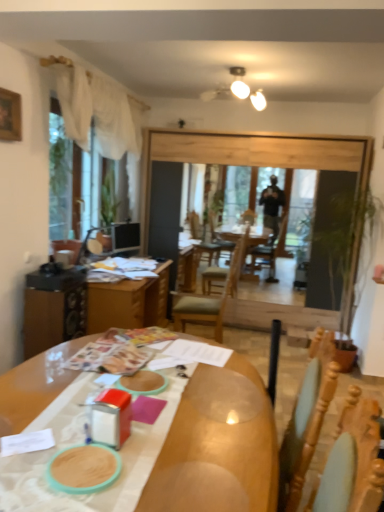
Question: Can you confirm if wooden chair at center is smaller than wooden table at center?

Choices:
 (A) yes
 (B) no

Answer: (A)

Question: Is the position of wooden chair at center more distant than that of wooden table at center?

Choices:
 (A) no
 (B) yes

Answer: (B)

Question: From a real-world perspective, is wooden chair at center positioned over wooden table at center based on gravity?

Choices:
 (A) no
 (B) yes

Answer: (B)

Question: Can you confirm if wooden chair at center is wider than wooden table at center?

Choices:
 (A) no
 (B) yes

Answer: (A)

Question: Is wooden chair at center positioned far away from wooden table at center?

Choices:
 (A) no
 (B) yes

Answer: (A)

Question: Can you confirm if wooden chair at center is positioned to the left of wooden table at center?

Choices:
 (A) yes
 (B) no

Answer: (B)

Question: From the image's perspective, does wooden picture frame at upper left appear lower than matte black monitor at left?

Choices:
 (A) yes
 (B) no

Answer: (B)

Question: Can you confirm if wooden picture frame at upper left is shorter than matte black monitor at left?

Choices:
 (A) no
 (B) yes

Answer: (B)

Question: Can you confirm if wooden picture frame at upper left is thinner than matte black monitor at left?

Choices:
 (A) yes
 (B) no

Answer: (A)

Question: Are wooden picture frame at upper left and matte black monitor at left making contact?

Choices:
 (A) no
 (B) yes

Answer: (A)

Question: Does wooden picture frame at upper left appear on the left side of matte black monitor at left?

Choices:
 (A) no
 (B) yes

Answer: (B)

Question: Considering the relative sizes of wooden picture frame at upper left and matte black monitor at left in the image provided, is wooden picture frame at upper left wider than matte black monitor at left?

Choices:
 (A) yes
 (B) no

Answer: (B)

Question: Does matte black monitor at left come in front of transparent glass window screen at left?

Choices:
 (A) no
 (B) yes

Answer: (A)